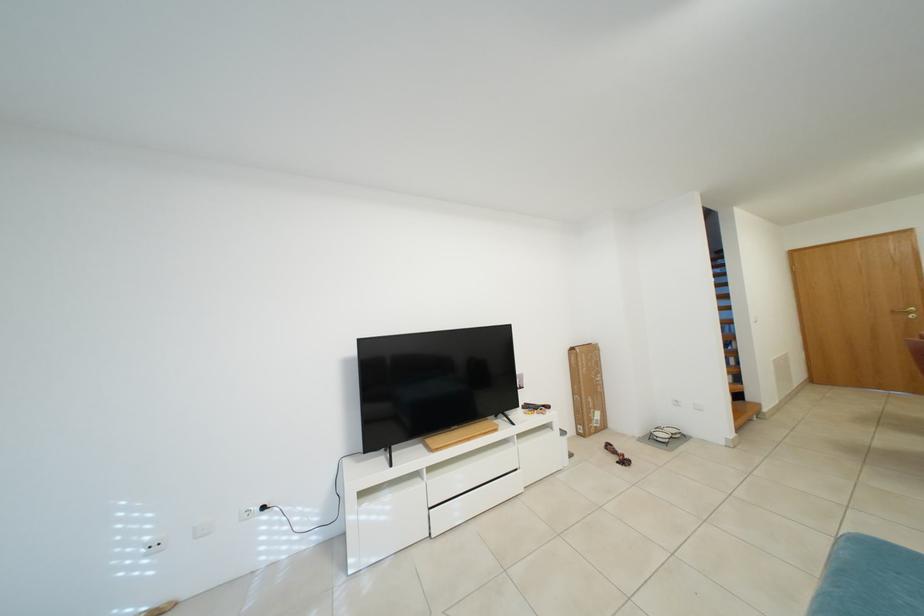
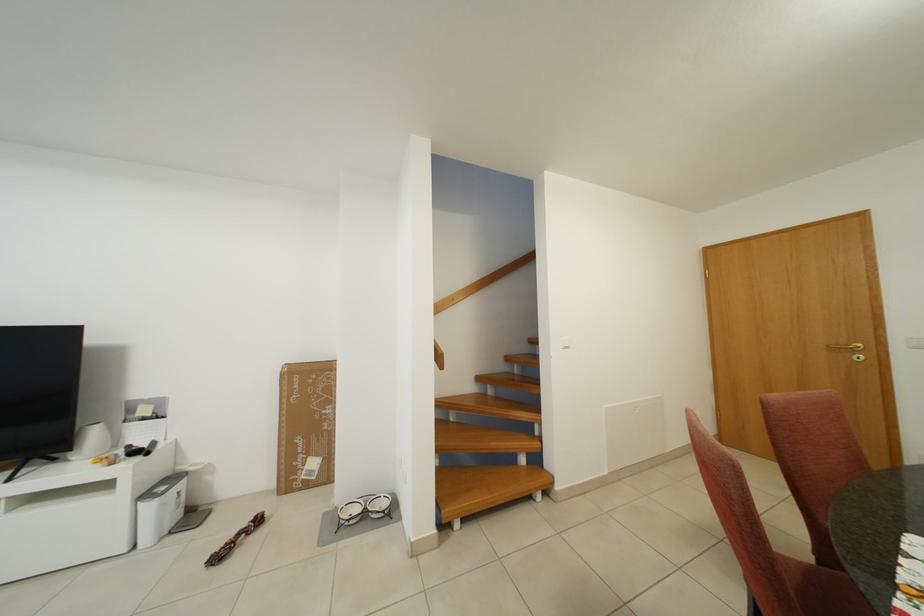
The point at (605,419) is marked in the first image. Where is the corresponding point in the second image?

(322, 468)